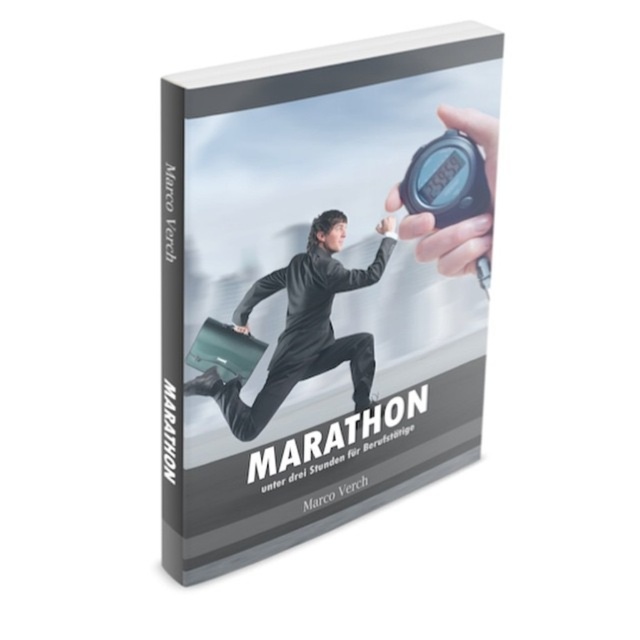
You are an artist analyzing the book cover. The black matte suit at center and the black plastic stopwatch at upper right are both important elements. Which object is closer to the viewer?

The black matte suit at center is closer to the viewer than the black plastic stopwatch at upper right.

You are designing a display for a library. You have a matte black book at center and a black plastic stopwatch at upper right. Which object should you place on the bottom shelf if you want to follow the rule that larger items go on lower shelves?

The matte black book at center is larger than the black plastic stopwatch at upper right, so it should be placed on the bottom shelf according to the rule.

You are an architect designing a new building. You have two reference points for the building design. The first point is at coordinate point (296, 420) and the second is at point (452, 256). According to the book cover image, which point is closer to the viewer?

Point (296, 420) is in front of point (452, 256), so it is closer to the viewer.